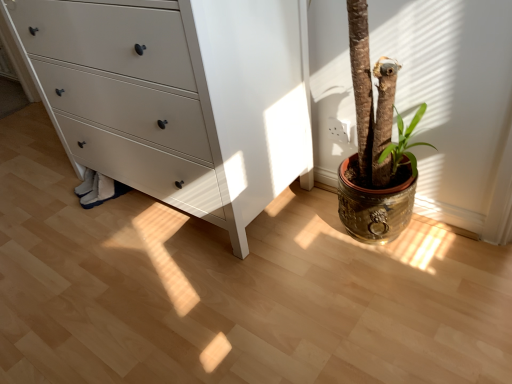
Where is `free point in front of white matte chest of drawers at left`? The width and height of the screenshot is (512, 384). free point in front of white matte chest of drawers at left is located at coordinates (175, 297).